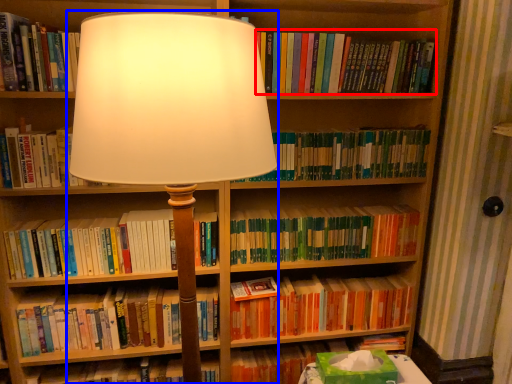
Question: Which point is closer to the camera, book (highlighted by a red box) or lamp (highlighted by a blue box)?

Choices:
 (A) book
 (B) lamp

Answer: (B)